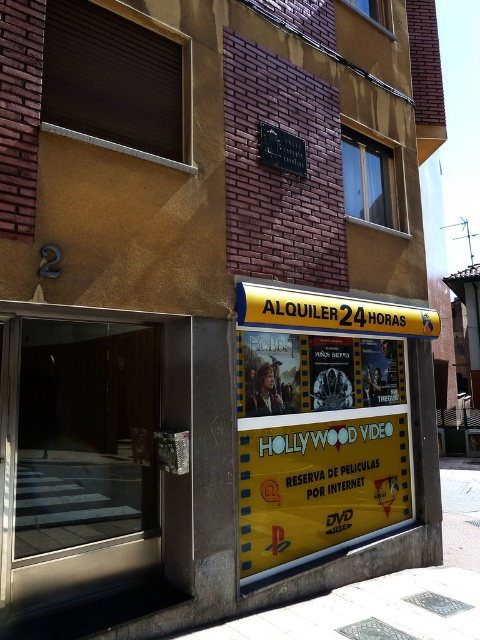
Question: Which point is closer to the camera?

Choices:
 (A) yellow filmstrip at center
 (B) transparent glass door at left

Answer: (B)

Question: Is yellow filmstrip at center below white concrete pavement at lower center?

Choices:
 (A) yes
 (B) no

Answer: (B)

Question: Does transparent glass door at left appear on the right side of yellow filmstrip at center?

Choices:
 (A) no
 (B) yes

Answer: (A)

Question: Considering the real-world distances, which object is farthest from the white concrete pavement at lower center?

Choices:
 (A) yellow filmstrip at center
 (B) transparent glass door at left

Answer: (B)

Question: Which point is closer to the camera?

Choices:
 (A) (386, 385)
 (B) (359, 605)

Answer: (B)

Question: Does transparent glass door at left come in front of white concrete pavement at lower center?

Choices:
 (A) yes
 (B) no

Answer: (A)